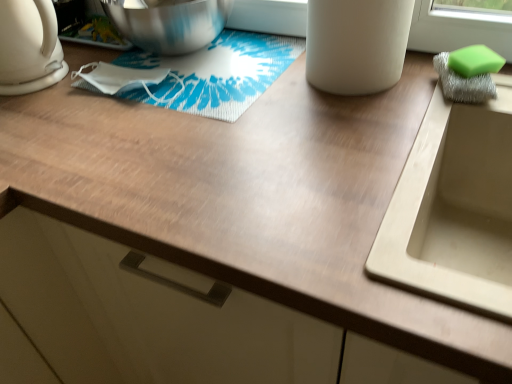
Question: Is white matte cup at upper center not inside green sponge at right?

Choices:
 (A) yes
 (B) no

Answer: (A)

Question: From the image's perspective, does white matte cup at upper center appear lower than green sponge at right?

Choices:
 (A) no
 (B) yes

Answer: (A)

Question: Is white matte cup at upper center at the right side of green sponge at right?

Choices:
 (A) no
 (B) yes

Answer: (A)

Question: From the image's perspective, does white matte cup at upper center appear higher than green sponge at right?

Choices:
 (A) yes
 (B) no

Answer: (A)

Question: Is white matte cup at upper center further to camera compared to green sponge at right?

Choices:
 (A) no
 (B) yes

Answer: (A)

Question: Is green sponge at right bigger or smaller than beige matte sink at right?

Choices:
 (A) small
 (B) big

Answer: (A)

Question: Is green sponge at right to the left or to the right of beige matte sink at right in the image?

Choices:
 (A) right
 (B) left

Answer: (A)

Question: Considering their positions, is green sponge at right located in front of or behind beige matte sink at right?

Choices:
 (A) front
 (B) behind

Answer: (B)

Question: Is green sponge at right wider or thinner than beige matte sink at right?

Choices:
 (A) wide
 (B) thin

Answer: (B)

Question: From their relative heights in the image, would you say white glossy kettle at left is taller or shorter than beige matte sink at right?

Choices:
 (A) tall
 (B) short

Answer: (B)

Question: Is point (48, 39) closer or farther from the camera than point (486, 140)?

Choices:
 (A) farther
 (B) closer

Answer: (A)

Question: In terms of size, does white glossy kettle at left appear bigger or smaller than beige matte sink at right?

Choices:
 (A) small
 (B) big

Answer: (A)

Question: From the image's perspective, is white glossy kettle at left above or below beige matte sink at right?

Choices:
 (A) below
 (B) above

Answer: (B)

Question: Is green sponge at right wider or thinner than white matte cup at upper center?

Choices:
 (A) wide
 (B) thin

Answer: (B)

Question: Considering the positions of point (499, 61) and point (371, 74), is point (499, 61) closer or farther from the camera than point (371, 74)?

Choices:
 (A) closer
 (B) farther

Answer: (A)